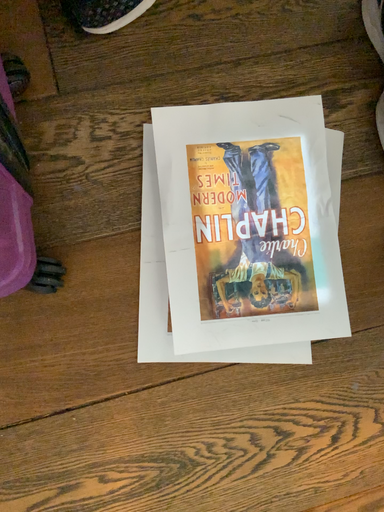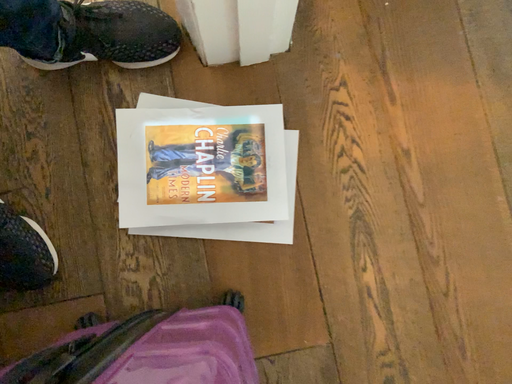
Question: How did the camera likely rotate when shooting the video?

Choices:
 (A) rotated left
 (B) rotated right

Answer: (B)